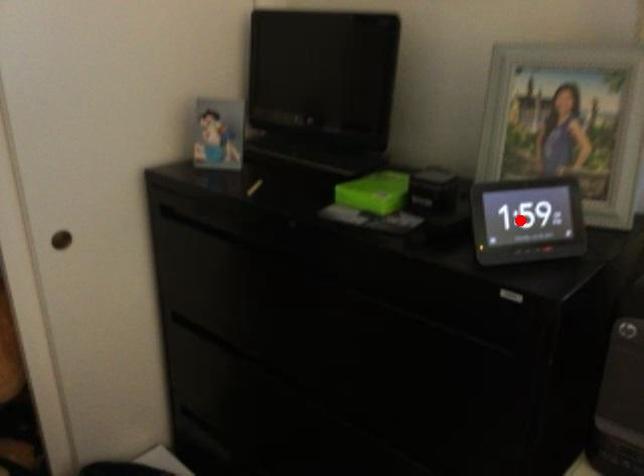
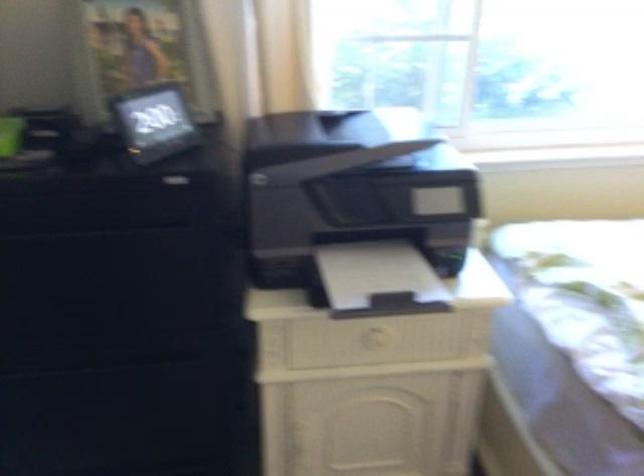
Question: A red point is marked in image1. In image2, is the corresponding 3D point closer to the camera or farther? Reply with the corresponding letter.

Choices:
 (A) The corresponding 3D point is closer.
 (B) The corresponding 3D point is farther.

Answer: (B)